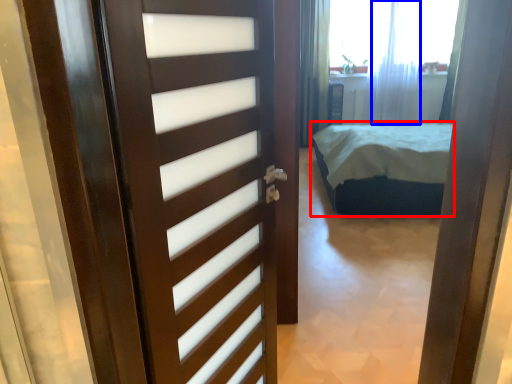
Question: Which of the following is the closest to the observer, bed (highlighted by a red box) or curtain (highlighted by a blue box)?

Choices:
 (A) bed
 (B) curtain

Answer: (A)